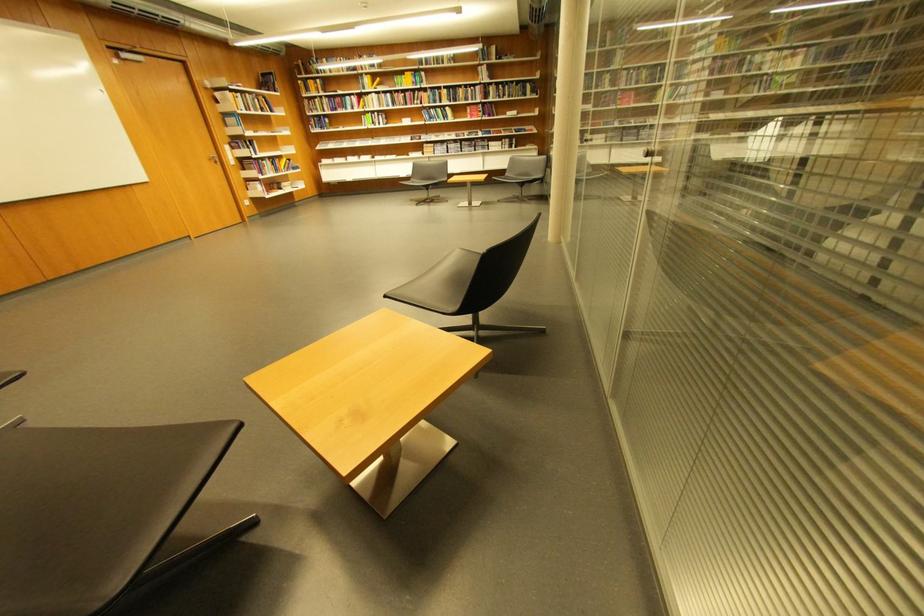
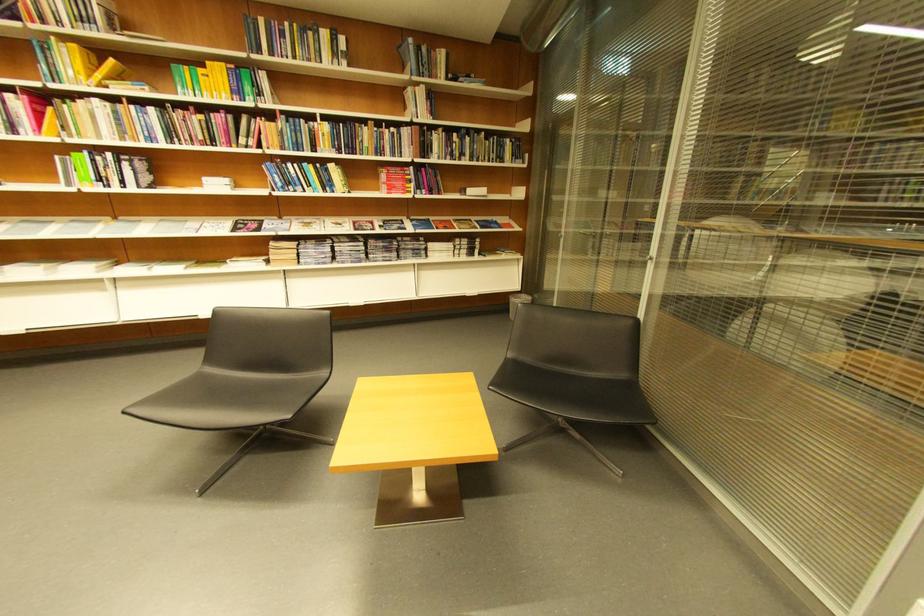
In the second image, find the point that corresponds to (x=482, y=108) in the first image.

(403, 172)